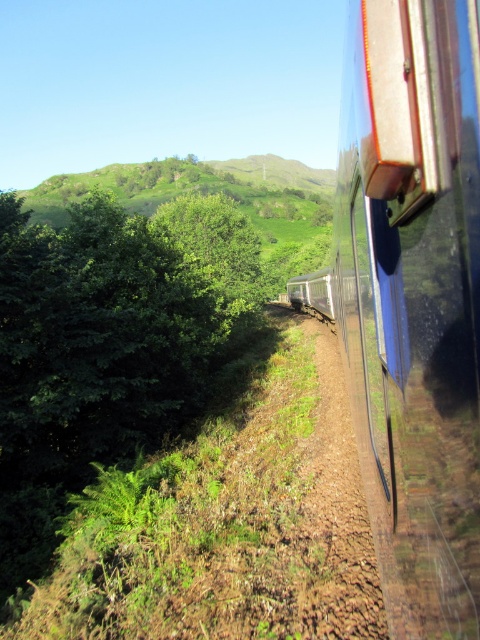
Question: Can you confirm if glossy metallic train at right is positioned to the left of brown gravel dirt track at right?

Choices:
 (A) yes
 (B) no

Answer: (A)

Question: Does glossy metallic train at right lie behind brown gravel dirt track at right?

Choices:
 (A) yes
 (B) no

Answer: (B)

Question: Is glossy metallic train at right behind brown gravel dirt track at right?

Choices:
 (A) no
 (B) yes

Answer: (A)

Question: Which object is farther from the camera taking this photo?

Choices:
 (A) brown gravel dirt track at right
 (B) glossy metallic train at right

Answer: (A)

Question: Which object is closer to the camera taking this photo?

Choices:
 (A) glossy metallic train at right
 (B) brown gravel dirt track at right

Answer: (A)